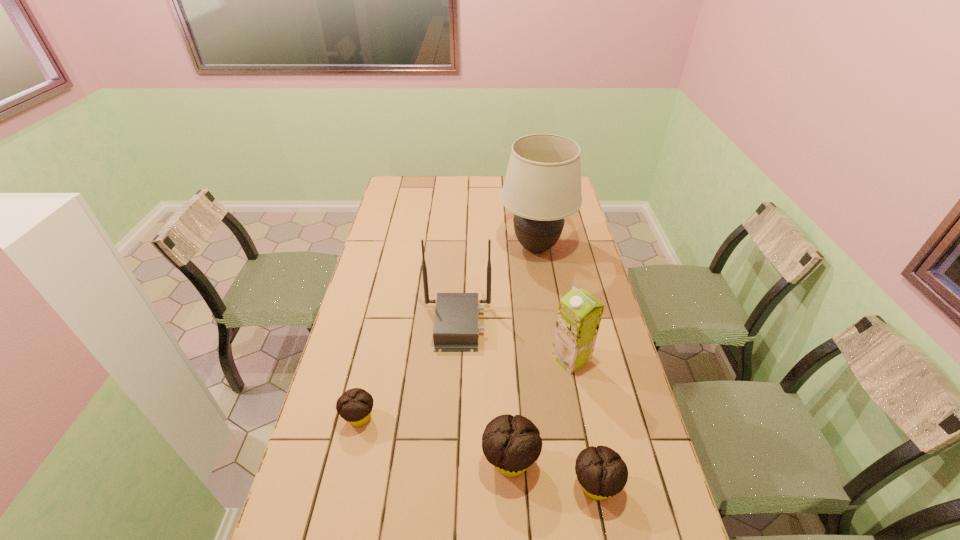
Find the location of `vacant area at the far edge of the desktop`. vacant area at the far edge of the desktop is located at coordinates (468, 183).

Where is `free point at the near edge`? The image size is (960, 540). free point at the near edge is located at coordinates (497, 519).

This screenshot has height=540, width=960. Find the location of `vacant space at the left edge of the desktop`. vacant space at the left edge of the desktop is located at coordinates (395, 309).

Locate an element on the screen. The width and height of the screenshot is (960, 540). vacant space at the right edge of the desktop is located at coordinates (554, 263).

Where is `vacant space at the far left corner of the desktop`? vacant space at the far left corner of the desktop is located at coordinates (400, 187).

Where is `vacant position at the near right corner of the desktop`? Image resolution: width=960 pixels, height=540 pixels. vacant position at the near right corner of the desktop is located at coordinates (669, 516).

Locate an element on the screen. free area in between the router and the fourth tallest object is located at coordinates [484, 393].

Locate an element on the screen. free space between the tallest muffin and the router is located at coordinates click(x=484, y=393).

I want to click on free space between the tallest muffin and the rightmost muffin, so click(553, 473).

You are a GUI agent. You are given a task and a screenshot of the screen. Output one action in this format:
    pyautogui.click(x=<x>, y=<y>)
    Task: Click on the vacant area that lies between the tallest object and the second muffin from right to left
    
    Given the screenshot: What is the action you would take?
    pyautogui.click(x=523, y=354)